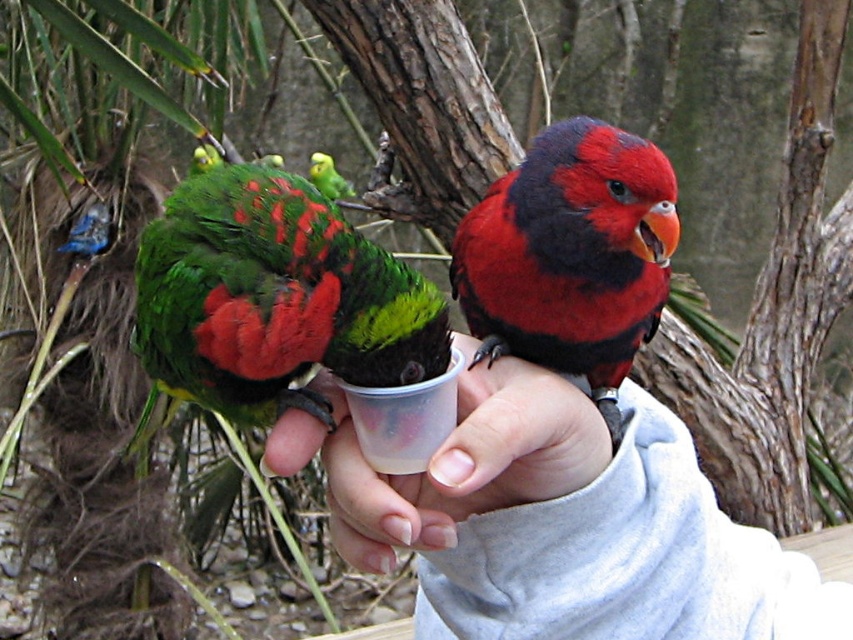
You are a birdwatcher observing two green matte parrots in the scene. Which parrot is taller, the green matte parrot at center or the green matte parrot at upper left?

The green matte parrot at center is taller than the green matte parrot at upper left according to the description.

You are holding a camera and want to take a photo of the point at coordinates point (410, 288). The camera has a minimum focus distance of 20 inches. Will the point be in focus?

The point (410, 288) is 19.90 inches from the camera, which is slightly closer than the minimum focus distance of 20 inches. Therefore, the point may not be in focus.

You are a bird trainer holding a smooth plastic cup at center and a green matte parrot at upper left. The parrot wants to drink from the cup. Can the parrot reach the cup easily?

The smooth plastic cup at center is in front of the green matte parrot at upper left, so the parrot can easily reach the cup as it is positioned directly in front of it.